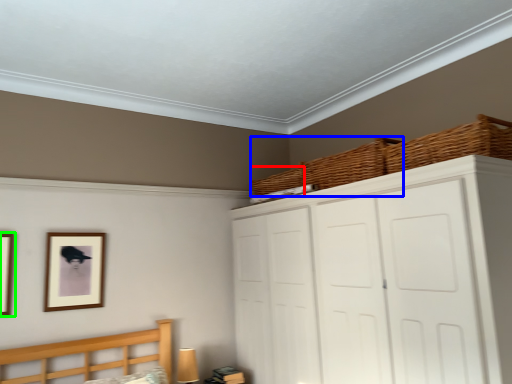
Question: Which is nearer to the basket (highlighted by a red box)? basket (highlighted by a blue box) or picture frame (highlighted by a green box).

Choices:
 (A) basket
 (B) picture frame

Answer: (A)